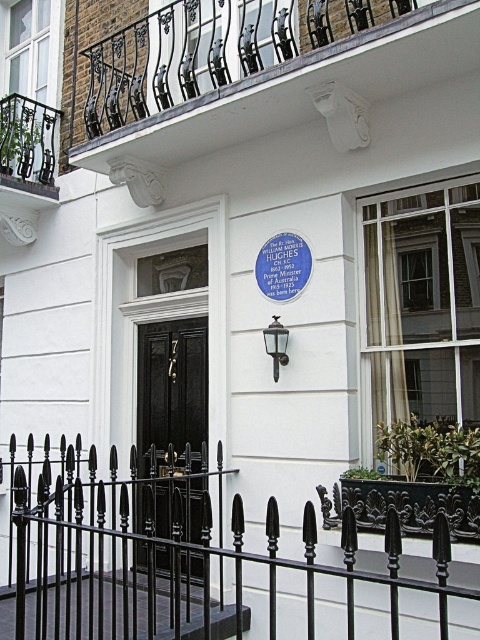
Question: Among these points, which one is farthest from the camera?

Choices:
 (A) (94, 161)
 (B) (158, 554)
 (C) (189, 634)
 (D) (292, 268)

Answer: (B)

Question: Which point appears closest to the camera in this image?

Choices:
 (A) (144, 58)
 (B) (158, 586)
 (C) (282, 275)
 (D) (182, 413)

Answer: (C)

Question: Among these points, which one is farthest from the camera?

Choices:
 (A) (169, 541)
 (B) (287, 252)
 (C) (176, 429)

Answer: (C)

Question: Does black wrought iron fence at lower center lie in front of black polished wood door at center?

Choices:
 (A) no
 (B) yes

Answer: (B)

Question: Can you confirm if black polished wood door at center is positioned above bluematerial/textureplaque at center?

Choices:
 (A) yes
 (B) no

Answer: (B)

Question: Does black wrought iron fence at lower center have a greater width compared to white wrought iron balcony at upper center?

Choices:
 (A) yes
 (B) no

Answer: (A)